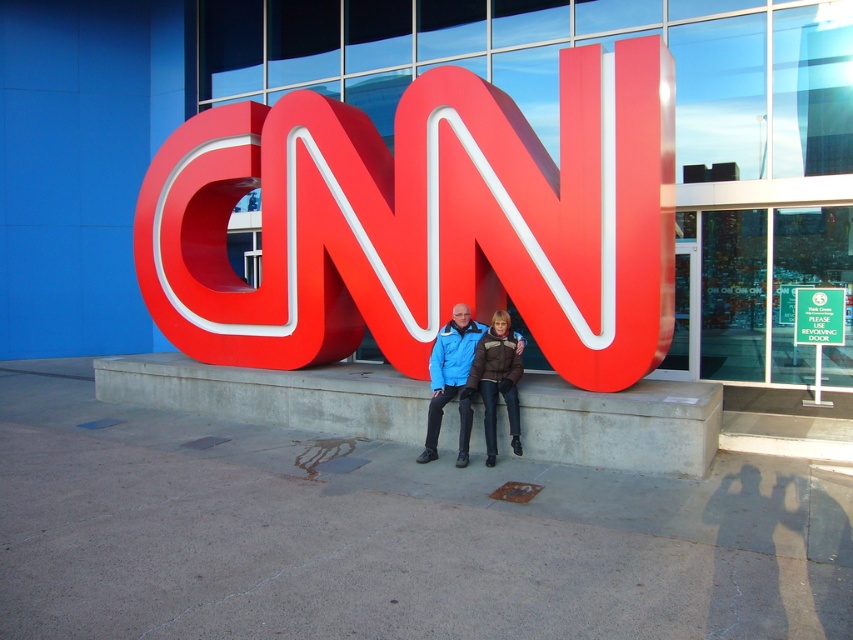
Between matte blue jacket at center and green plastic sign at center, which one appears on the left side from the viewer's perspective?

From the viewer's perspective, matte blue jacket at center appears more on the left side.

Can you confirm if matte blue jacket at center is positioned to the left of green plastic sign at center?

Correct, you'll find matte blue jacket at center to the left of green plastic sign at center.

Is point (428, 432) farther from viewer compared to point (801, 339)?

No, it is in front of (801, 339).

This screenshot has width=853, height=640. What are the coordinates of `matte blue jacket at center` in the screenshot? It's located at (451, 380).

Image resolution: width=853 pixels, height=640 pixels. What do you see at coordinates (425, 221) in the screenshot?
I see `shiny plastic letter at center` at bounding box center [425, 221].

Locate an element on the screen. This screenshot has width=853, height=640. shiny plastic letter at center is located at coordinates (425, 221).

What do you see at coordinates (425, 221) in the screenshot?
I see `shiny plastic letter at center` at bounding box center [425, 221].

Between shiny plastic letter at center and matte blue jacket at center, which one has less height?

shiny plastic letter at center

Who is more forward, (637, 154) or (473, 328)?

Point (637, 154) is more forward.

Locate an element on the screen. This screenshot has height=640, width=853. shiny plastic letter at center is located at coordinates (425, 221).